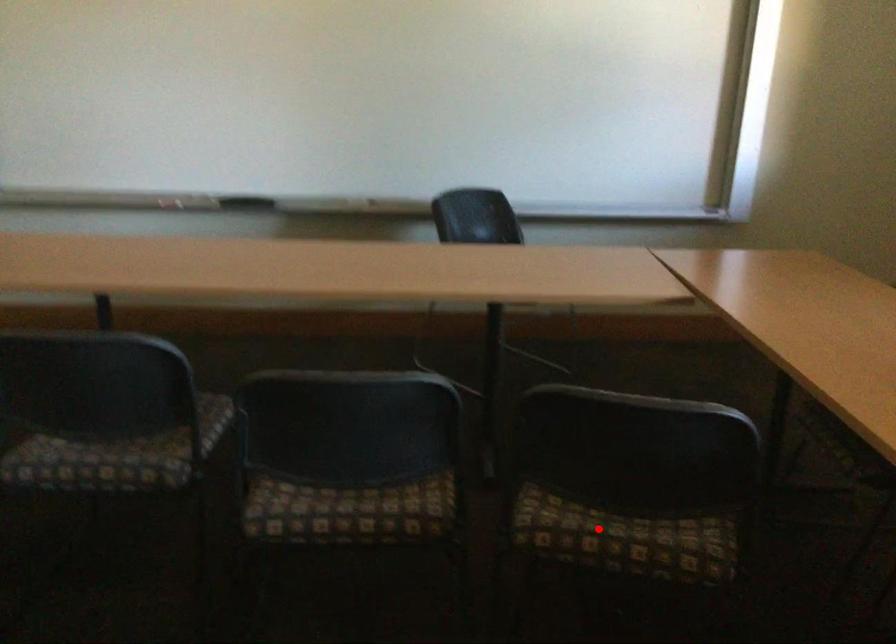
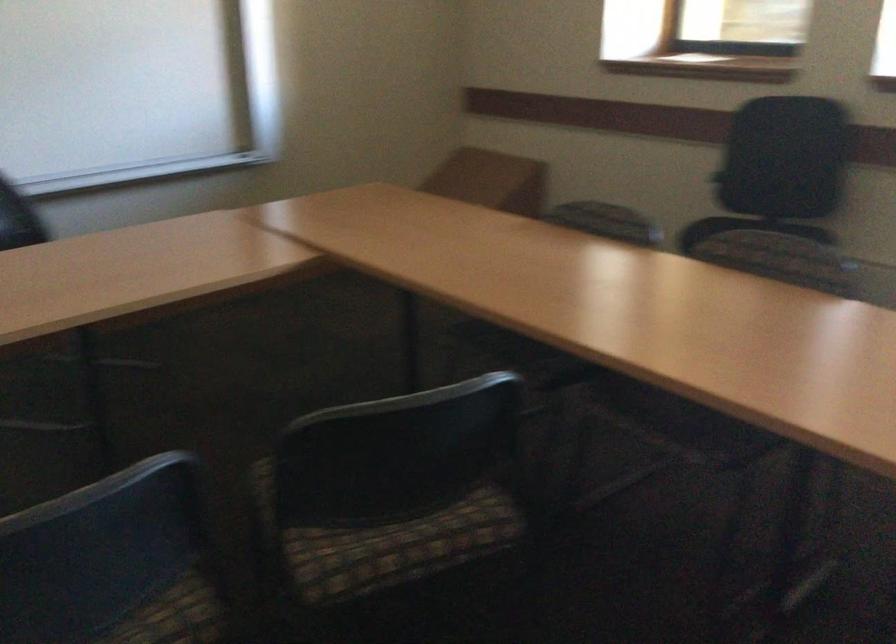
Question: I am providing you with two images of the same scene from different viewpoints. A red point is shown in image1. For the corresponding object point in image2, is it positioned nearer or farther from the camera?

Choices:
 (A) Nearer
 (B) Farther

Answer: (A)